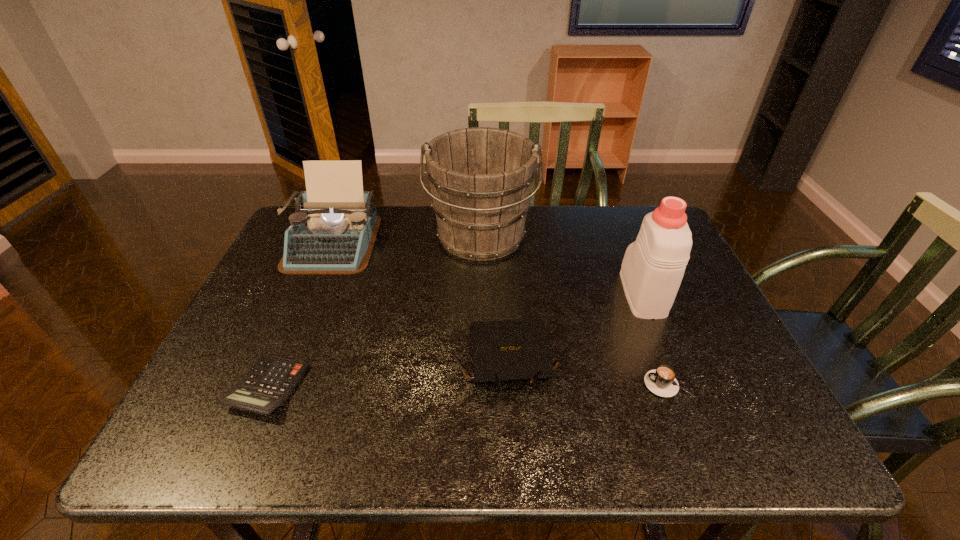
Identify the location of bucket. (481, 178).

Find the location of a particular element. detergent is located at coordinates (653, 266).

You are a GUI agent. You are given a task and a screenshot of the screen. Output one action in this format:
    pyautogui.click(x=<x>, y=<y>)
    Task: Click on the typewriter
    
    Given the screenshot: What is the action you would take?
    pyautogui.click(x=333, y=231)

Where is `router`? This screenshot has width=960, height=540. router is located at coordinates (510, 350).

Where is `cappuccino`? The image size is (960, 540). cappuccino is located at coordinates (661, 381).

In order to click on calculator in this screenshot , I will do `click(268, 384)`.

The image size is (960, 540). I want to click on vacant space positioned on the handle side of the bucket, so click(481, 325).

Image resolution: width=960 pixels, height=540 pixels. Find the location of `vacant area situated on the handle side of the detergent`. vacant area situated on the handle side of the detergent is located at coordinates (609, 210).

I want to click on free space located 0.150m on the handle side of the detergent, so click(620, 238).

Identify the location of vacant space located 0.070m on the handle side of the detergent. The width and height of the screenshot is (960, 540). (627, 255).